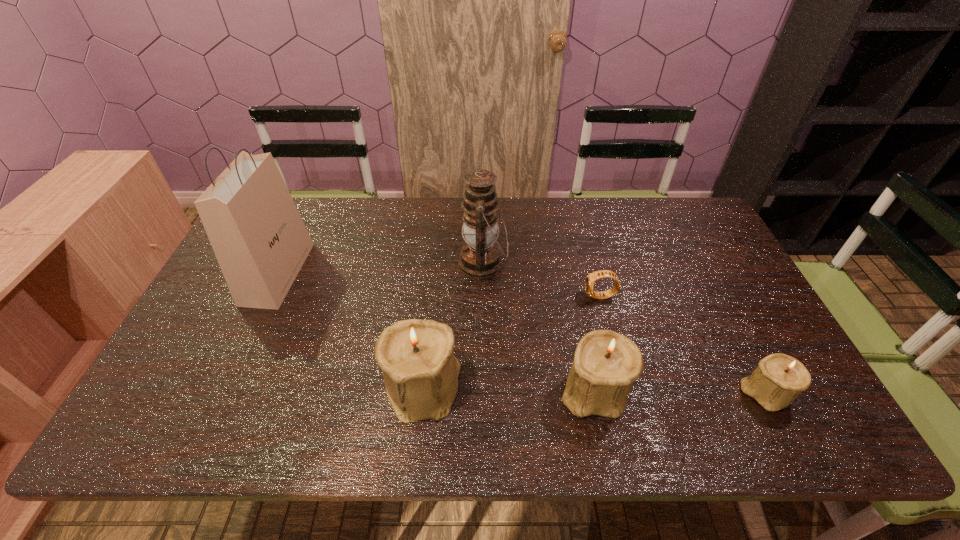
Locate an element on the screen. The height and width of the screenshot is (540, 960). the leftmost candle_holder is located at coordinates (416, 356).

Find the location of a particular element. The image size is (960, 540). the second candle_holder from right to left is located at coordinates (606, 363).

This screenshot has height=540, width=960. Find the location of `the third shortest object`. the third shortest object is located at coordinates (606, 363).

Locate an element on the screen. This screenshot has width=960, height=540. the fifth tallest object is located at coordinates (778, 379).

The width and height of the screenshot is (960, 540). Identify the location of the rightmost candle_holder. (778, 379).

The height and width of the screenshot is (540, 960). Identify the location of lantern. pyautogui.click(x=480, y=257).

At what (x,y) coordinates should I click in order to perform the action: click on the tallest object. Please return your answer as a coordinate pair (x, y). This screenshot has width=960, height=540. Looking at the image, I should click on (260, 241).

Find the location of `the leftmost object`. the leftmost object is located at coordinates (260, 241).

Locate an element on the screen. Image resolution: width=960 pixels, height=540 pixels. the shortest object is located at coordinates (592, 277).

Where is `free spot located 0.240m on the back of the leftmost candle_holder`? free spot located 0.240m on the back of the leftmost candle_holder is located at coordinates (434, 285).